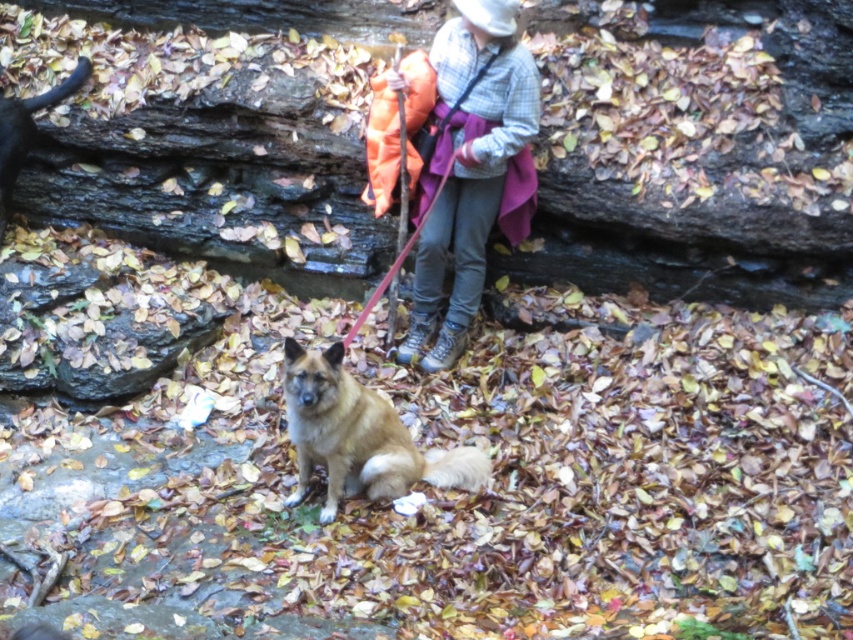
You are standing 5 meters away from the camera and see the plaid flannel shirt at upper center. Can you reach it without moving closer?

The plaid flannel shirt at upper center is 4.65 meters from the camera, so since you are 5 meters away, you cannot reach it without moving closer.

You are a photographer trying to capture the brown fur dog at center and the plaid flannel shirt at upper center in the same frame. Based on their positions, which one is closer to the camera?

The plaid flannel shirt at upper center is taller than the brown fur dog at center, so it is closer to the camera.